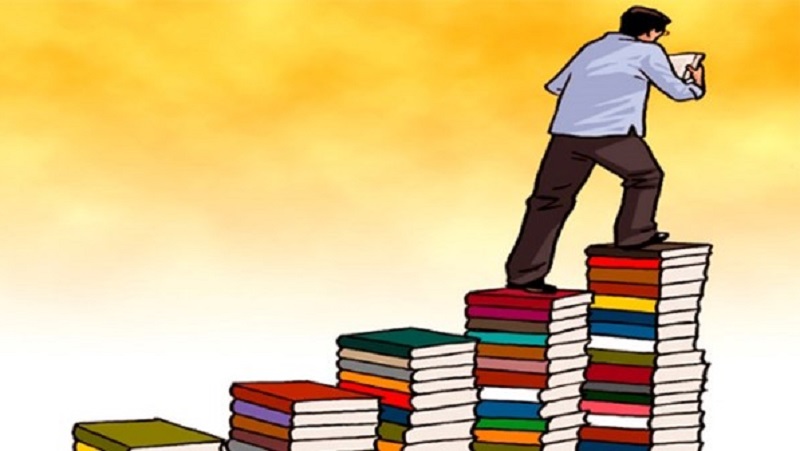
Locate an element on the screen. Image resolution: width=800 pixels, height=451 pixels. green books is located at coordinates (158, 435), (416, 346), (402, 435), (546, 429), (486, 447), (609, 360).